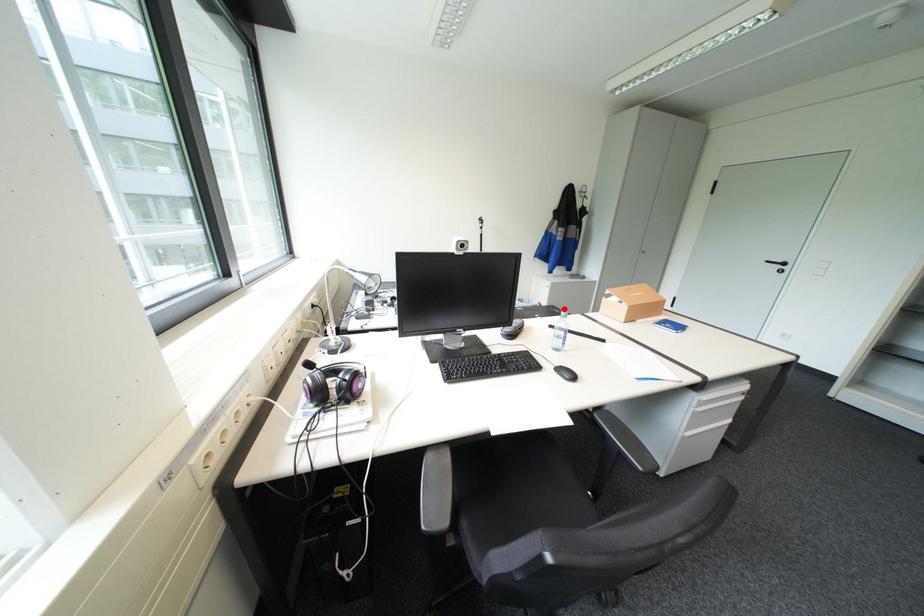
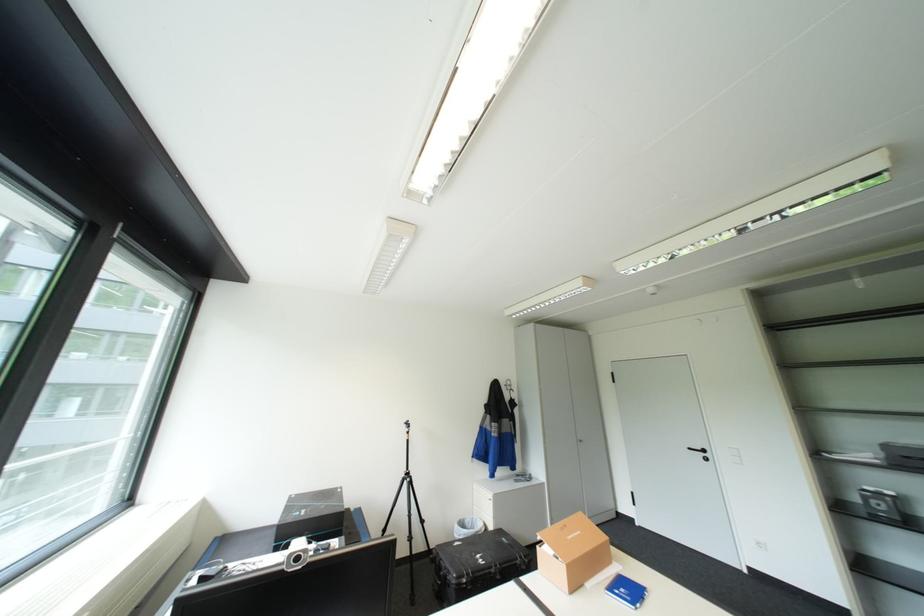
In the second image, find the point that corresponds to the highlighted location in the first image.

(513, 538)